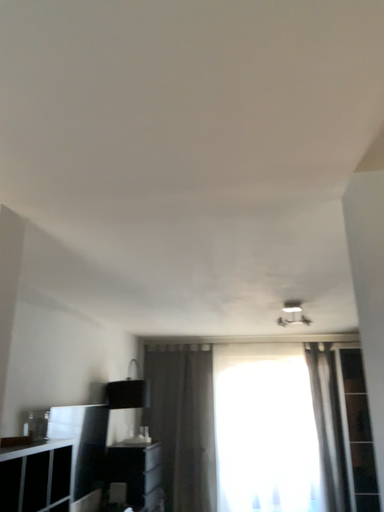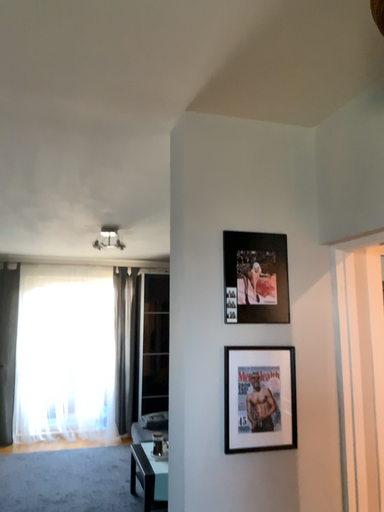
Question: Which way did the camera rotate in the video?

Choices:
 (A) rotated downward
 (B) rotated upward

Answer: (A)